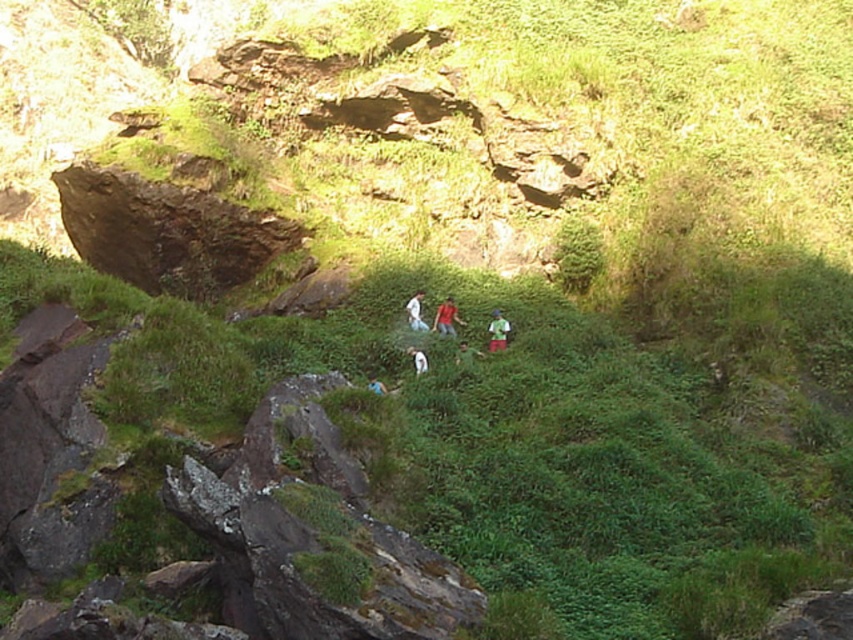
You are a photographer trying to capture a photo of the white matte dog at center and the blue fabric person at center. The camera you have can only focus on objects within a 30 inch range. Can you get a clear photo of both subjects without moving the camera?

The white matte dog at center is 35.07 inches from the blue fabric person at center, which is beyond the camera focus range of 30 inches. Therefore, you cannot capture both subjects clearly in the same photo without moving the camera.

You are a photographer trying to capture a clear image of the white matte shirt at center and the white matte dog at center. Which object should you focus on first if you want to ensure both are in focus?

The white matte shirt at center is above the white matte dog at center, so focusing on the shirt first will help ensure both are in focus as they are aligned vertically.

You are a photographer trying to capture the group of people in the middle ground of the natural outdoor scene. You notice a point at coordinates (415, 312). What object is located at that point?

The point at coordinates (415, 312) indicates the white matte shirt at center.